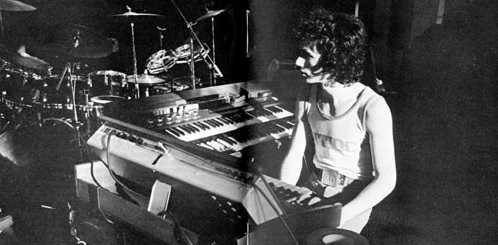
You are a GUI agent. You are given a task and a screenshot of the screen. Output one action in this format:
    pyautogui.click(x=<x>, y=<y>)
    Task: Click on the synthesizer
    Image resolution: width=498 pixels, height=245 pixels.
    Given the screenshot: What is the action you would take?
    pyautogui.click(x=228, y=189)